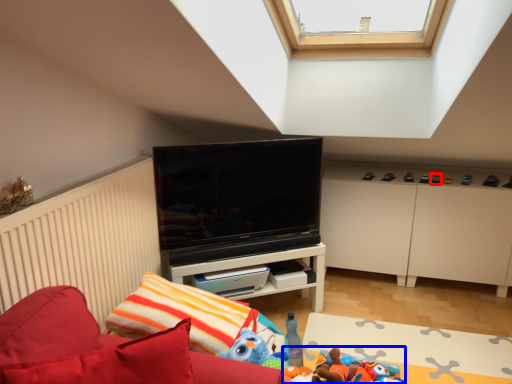
Question: Which object is closer to the camera taking this photo, toy (highlighted by a red box) or toy (highlighted by a blue box)?

Choices:
 (A) toy
 (B) toy

Answer: (B)